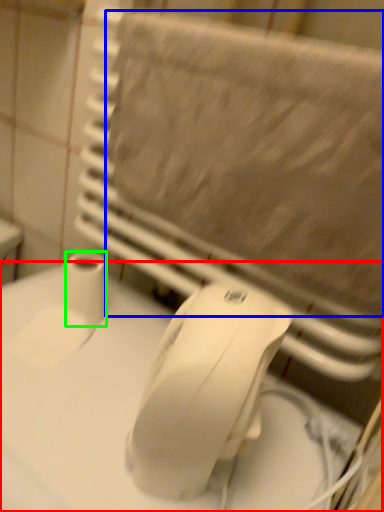
Question: Estimate the real-world distances between objects in this image. Which object is farther from counter top (highlighted by a red box), bath towel (highlighted by a blue box) or toilet paper (highlighted by a green box)?

Choices:
 (A) bath towel
 (B) toilet paper

Answer: (A)